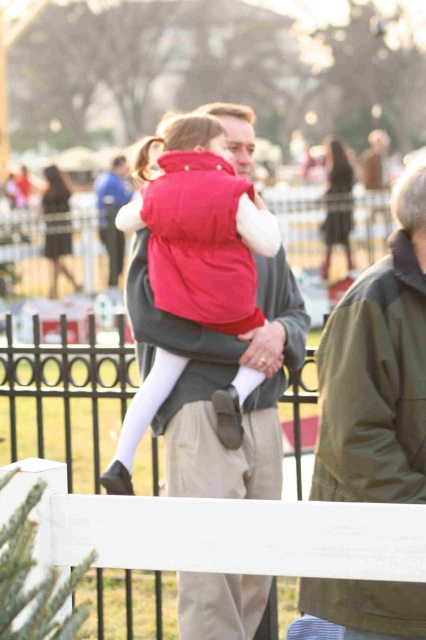
Is matte gray sweater at center bigger than black dress at center?

Indeed, matte gray sweater at center has a larger size compared to black dress at center.

Is point (103, 241) farther from camera compared to point (49, 252)?

That is False.

Is point (115, 268) positioned after point (57, 234)?

No, it is in front of (57, 234).

The width and height of the screenshot is (426, 640). I want to click on matte gray sweater at center, so click(x=112, y=212).

Based on the photo, does matte red vest at center appear over black dress at center?

No, matte red vest at center is not above black dress at center.

Does point (270, 237) come farther from viewer compared to point (52, 273)?

No, (270, 237) is closer to viewer.

This screenshot has height=640, width=426. I want to click on matte red vest at center, so click(203, 227).

Which is above, khaki fabric jacket at right or matte gray sweater at center?

matte gray sweater at center is above.

Based on the photo, who is lower down, khaki fabric jacket at right or matte gray sweater at center?

Positioned lower is khaki fabric jacket at right.

Is point (370, 417) closer to camera compared to point (103, 205)?

Yes, it is.

At what (x,y) coordinates should I click in order to perform the action: click on khaki fabric jacket at right. Please return your answer as a coordinate pair (x, y). The height and width of the screenshot is (640, 426). Looking at the image, I should click on (377, 369).